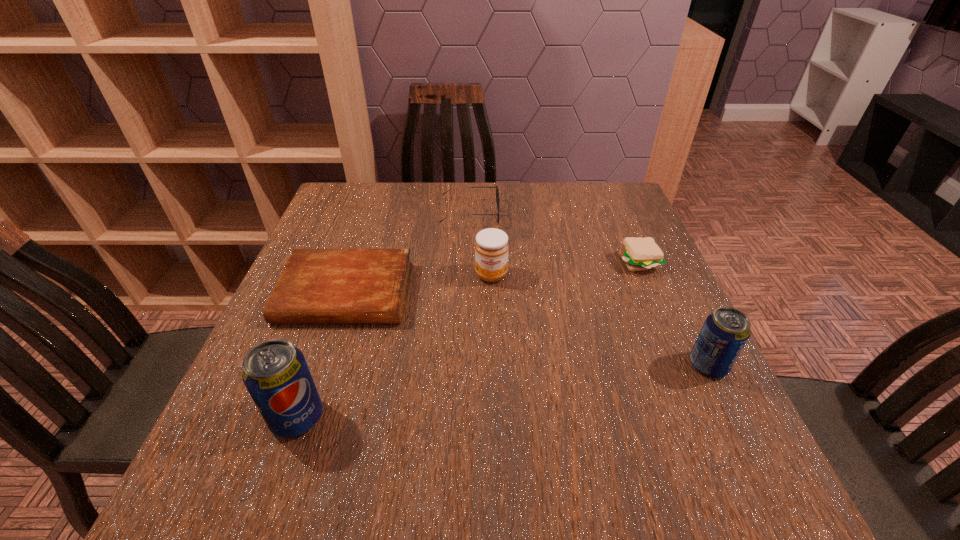
I want to click on the nearest object, so click(276, 375).

Identify the location of the taller soda. Image resolution: width=960 pixels, height=540 pixels. (276, 375).

Where is `the shorter soda`? the shorter soda is located at coordinates (725, 332).

Identify the location of the farther soda. This screenshot has height=540, width=960. tap(725, 332).

Where is `the farthest object`? The height and width of the screenshot is (540, 960). the farthest object is located at coordinates (497, 204).

Find the location of `Bible`. Bible is located at coordinates (317, 286).

At what (x,y) coordinates should I click in order to perform the action: click on patty. Please return your answer as a coordinate pair (x, y). The width and height of the screenshot is (960, 540). Looking at the image, I should click on (639, 254).

This screenshot has width=960, height=540. Find the location of `the third tallest object`. the third tallest object is located at coordinates (491, 247).

I want to click on free space located on the back of the tallest object, so click(x=324, y=340).

At what (x,y) coordinates should I click in order to perform the action: click on vacant space situated 0.120m on the left of the right soda. Please return your answer as a coordinate pair (x, y). This screenshot has width=960, height=540. Looking at the image, I should click on (627, 365).